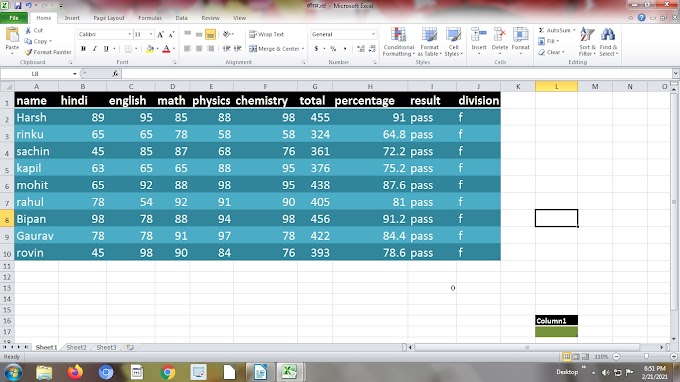
I want to click on dark blue rows on table, so click(x=52, y=115), click(x=50, y=146), click(x=56, y=184), click(x=56, y=219), click(x=49, y=256).